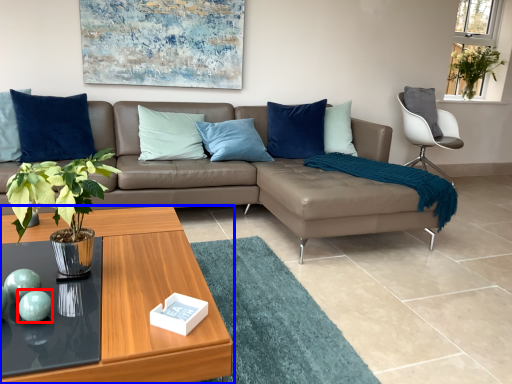
Question: Which object appears closest to the camera in this image, teal (highlighted by a red box) or coffee table (highlighted by a blue box)?

Choices:
 (A) teal
 (B) coffee table

Answer: (B)